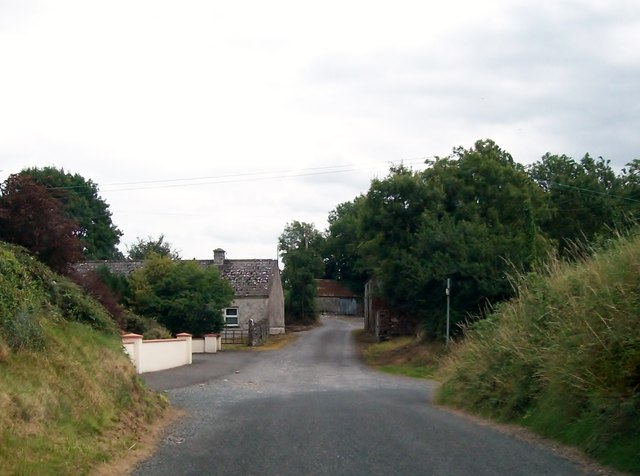
Locate an element on the screen. This screenshot has height=476, width=640. window is located at coordinates (234, 314).